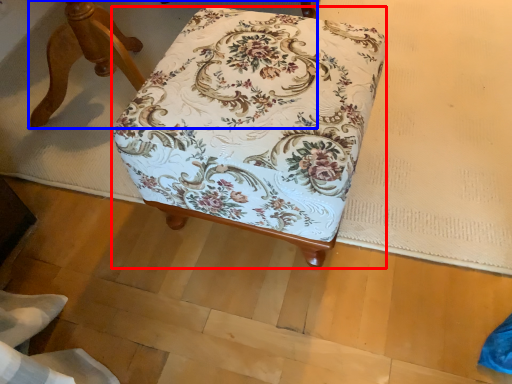
Question: Which of the following is the farthest to the observer, furniture (highlighted by a red box) or furniture (highlighted by a blue box)?

Choices:
 (A) furniture
 (B) furniture

Answer: (B)